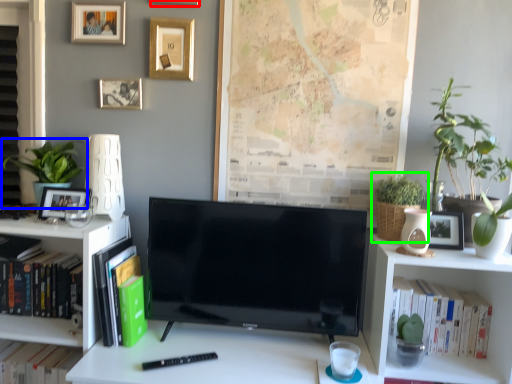
Question: Which object is the farthest from picture frame (highlighted by a red box)? Choose among these: houseplant (highlighted by a blue box) or houseplant (highlighted by a green box).

Choices:
 (A) houseplant
 (B) houseplant

Answer: (B)